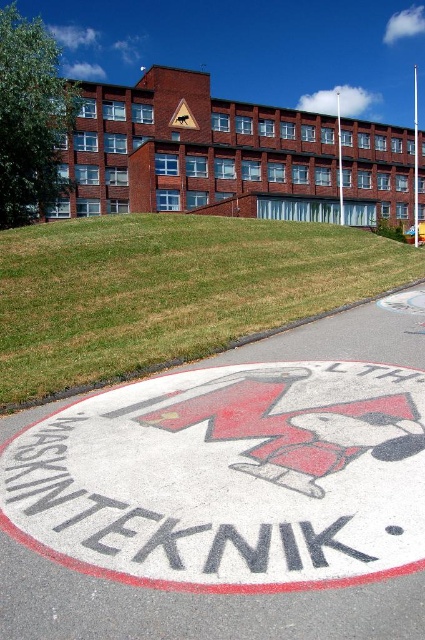
Question: Is white asphalt circle at center in front of yellow plastic triangle at upper center?

Choices:
 (A) yes
 (B) no

Answer: (A)

Question: Does white asphalt circle at center lie behind yellow plastic triangle at upper center?

Choices:
 (A) no
 (B) yes

Answer: (A)

Question: Among these objects, which one is farthest from the camera?

Choices:
 (A) yellow plastic triangle at upper center
 (B) white asphalt circle at center

Answer: (A)

Question: Is the position of white asphalt circle at center more distant than that of yellow plastic triangle at upper center?

Choices:
 (A) yes
 (B) no

Answer: (B)